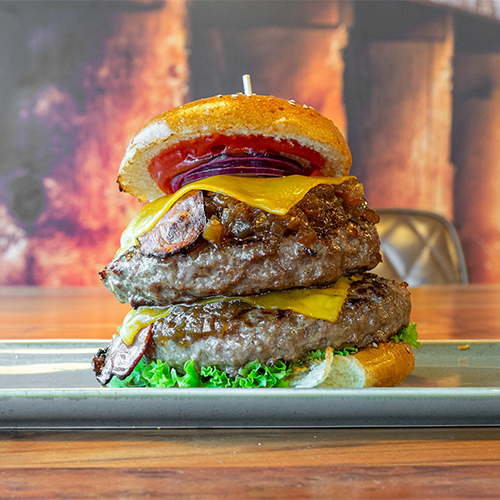
Identify the location of chair. This screenshot has width=500, height=500. (422, 252).